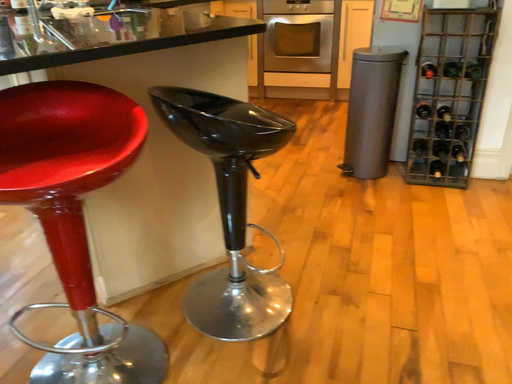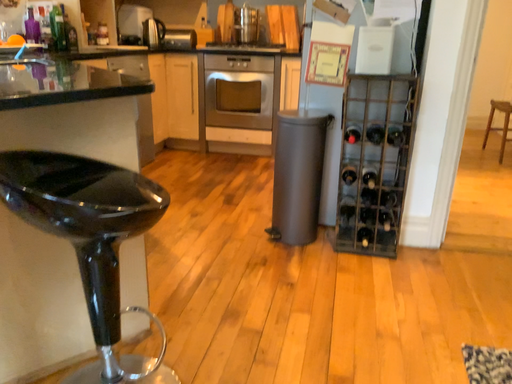
Question: Which way did the camera rotate in the video?

Choices:
 (A) rotated downward
 (B) rotated upward

Answer: (B)